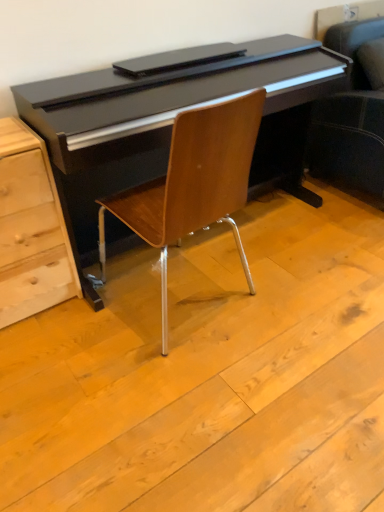
This screenshot has height=512, width=384. Describe the element at coordinates (194, 183) in the screenshot. I see `woodenchair at center` at that location.

I want to click on woodenchair at center, so click(194, 183).

What do you see at coordinates (31, 229) in the screenshot? I see `light wood chest of drawers at lower left` at bounding box center [31, 229].

Measure the distance between light wood chest of drawers at lower left and camera.

1.30 meters.

This screenshot has height=512, width=384. Identify the location of light wood chest of drawers at lower left. (31, 229).

You are a GUI agent. You are given a task and a screenshot of the screen. Output one action in this format:
    pyautogui.click(x=<x>, y=<y>)
    Task: Click on the woodenchair at center
    The height and width of the screenshot is (512, 384).
    Given the screenshot: What is the action you would take?
    pyautogui.click(x=194, y=183)

Is woodenchair at center to the right of light wood chest of drawers at lower left from the viewer's perspective?

Yes.

Which object is more forward, woodenchair at center or light wood chest of drawers at lower left?

Positioned in front is woodenchair at center.

Is point (163, 340) in front of point (59, 202)?

That is False.

From the image's perspective, is woodenchair at center above or below light wood chest of drawers at lower left?

woodenchair at center is above light wood chest of drawers at lower left.

From a real-world perspective, between woodenchair at center and light wood chest of drawers at lower left, who is vertically lower?

light wood chest of drawers at lower left.

Does woodenchair at center have a greater width compared to light wood chest of drawers at lower left?

Indeed, woodenchair at center has a greater width compared to light wood chest of drawers at lower left.

Looking at this image, which of these two, woodenchair at center or light wood chest of drawers at lower left, stands shorter?

With less height is light wood chest of drawers at lower left.

Considering the sizes of objects woodenchair at center and light wood chest of drawers at lower left in the image provided, who is bigger, woodenchair at center or light wood chest of drawers at lower left?

Bigger between the two is woodenchair at center.

Is woodenchair at center not within light wood chest of drawers at lower left?

That's correct, woodenchair at center is outside of light wood chest of drawers at lower left.

Are woodenchair at center and light wood chest of drawers at lower left far apart?

No.

Is woodenchair at center facing towards light wood chest of drawers at lower left?

No, woodenchair at center is not facing towards light wood chest of drawers at lower left.

Locate an element on the screen. chair in front of the light wood chest of drawers at lower left is located at coordinates (194, 183).

Which object is positioned more to the left, light wood chest of drawers at lower left or woodenchair at center?

From the viewer's perspective, light wood chest of drawers at lower left appears more on the left side.

Is light wood chest of drawers at lower left further to camera compared to woodenchair at center?

Yes, the depth of light wood chest of drawers at lower left is greater than that of woodenchair at center.

Does point (23, 123) lie in front of point (164, 245)?

No.

From the image's perspective, is light wood chest of drawers at lower left located above woodenchair at center?

Actually, light wood chest of drawers at lower left appears below woodenchair at center in the image.

From a real-world perspective, is light wood chest of drawers at lower left under woodenchair at center?

Yes, from a real-world perspective, light wood chest of drawers at lower left is beneath woodenchair at center.

Considering the sizes of objects light wood chest of drawers at lower left and woodenchair at center in the image provided, who is thinner, light wood chest of drawers at lower left or woodenchair at center?

light wood chest of drawers at lower left.

Considering the sizes of light wood chest of drawers at lower left and woodenchair at center in the image, is light wood chest of drawers at lower left taller or shorter than woodenchair at center?

light wood chest of drawers at lower left is shorter than woodenchair at center.

Does light wood chest of drawers at lower left have a larger size compared to woodenchair at center?

No, light wood chest of drawers at lower left is not bigger than woodenchair at center.

Would you say light wood chest of drawers at lower left is inside or outside woodenchair at center?

light wood chest of drawers at lower left is outside woodenchair at center.

Is light wood chest of drawers at lower left far away from woodenchair at center?

No, light wood chest of drawers at lower left is not far away from woodenchair at center.

Could you tell me if light wood chest of drawers at lower left is turned towards woodenchair at center?

No.

Can you tell me how much light wood chest of drawers at lower left and woodenchair at center differ in facing direction?

180 degrees separate the facing orientations of light wood chest of drawers at lower left and woodenchair at center.

At what (x,y) coordinates should I click in order to perform the action: click on chest of drawers below the woodenchair at center (from the image's perspective). Please return your answer as a coordinate pair (x, y). The width and height of the screenshot is (384, 512). Looking at the image, I should click on (31, 229).

At what (x,y) coordinates should I click in order to perform the action: click on the chest of drawers lying below the woodenchair at center (from the image's perspective). Please return your answer as a coordinate pair (x, y). Image resolution: width=384 pixels, height=512 pixels. Looking at the image, I should click on (31, 229).

Identify the location of chair that is on the right side of light wood chest of drawers at lower left. This screenshot has height=512, width=384. (194, 183).